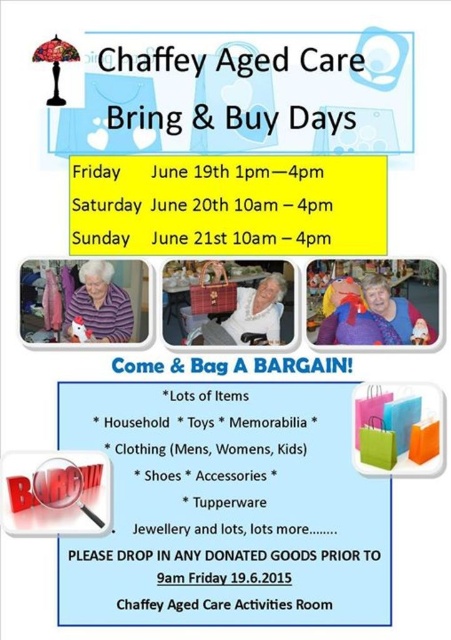
You are organizing the event and need to place a decorative banner between the white paper bag at center and the orange matte shopping bag at lower right. The banner is 30 inches long. Will it fit without overlapping either bag?

The distance between the white paper bag at center and the orange matte shopping bag at lower right is 35.73 inches. Since the banner is 30 inches long, it will fit between them without overlapping as there is enough space.

You are organizing a display for the Chaffey Aged Care Bring and Buy Days. You have a white fabric chair at center and a matte pink sweater at center. Which item takes up more horizontal space?

The white fabric chair at center has a larger width than the matte pink sweater at center, so it takes up more horizontal space.

You are organizing a display for the Chaffey Aged Care Bring and Buy Days. You have a purple striped sweater at center and a white fabric chair at center. Which item takes up more horizontal space?

The white fabric chair at center has a greater width than the purple striped sweater at center, so the white fabric chair at center takes up more horizontal space.